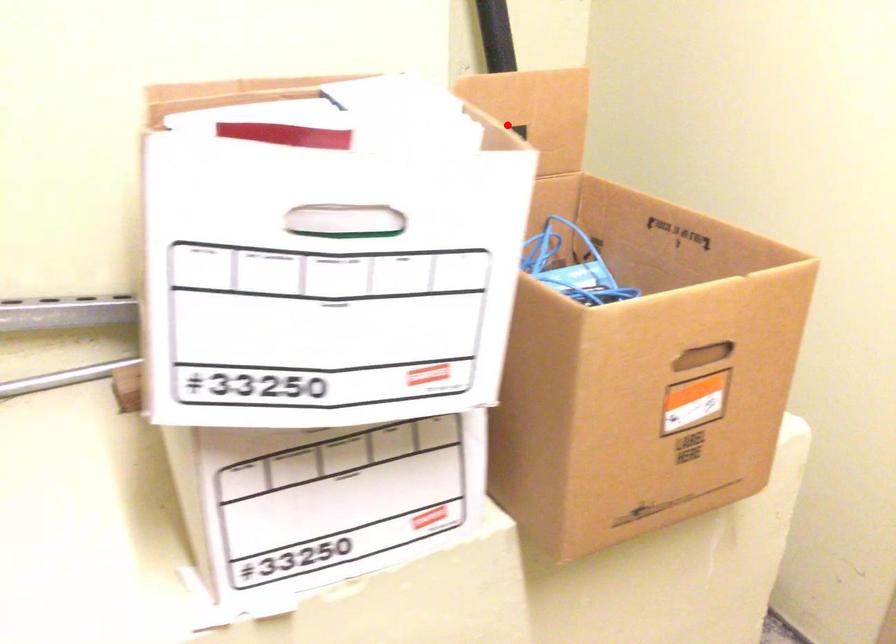
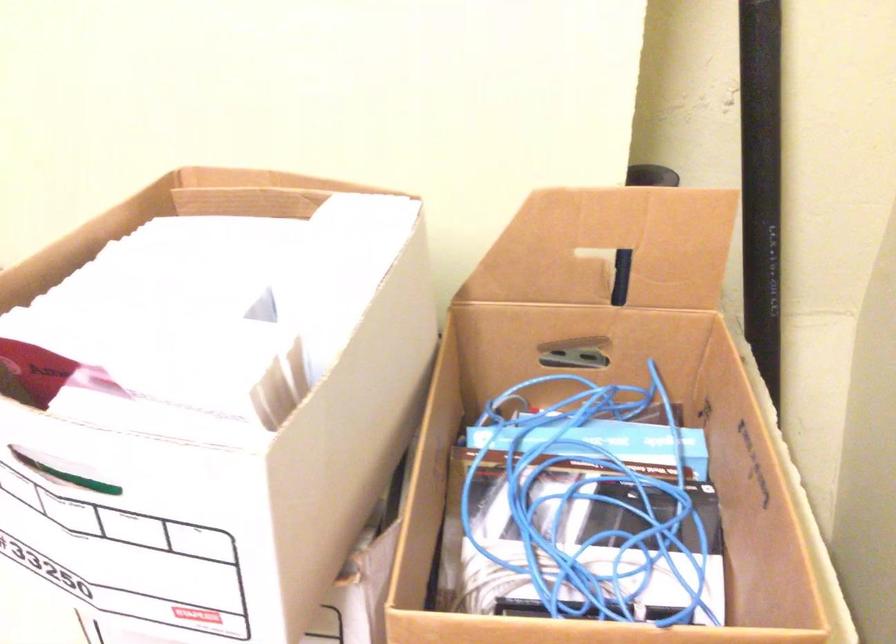
The point at the highlighted location is marked in the first image. Where is the corresponding point in the second image?

(609, 247)